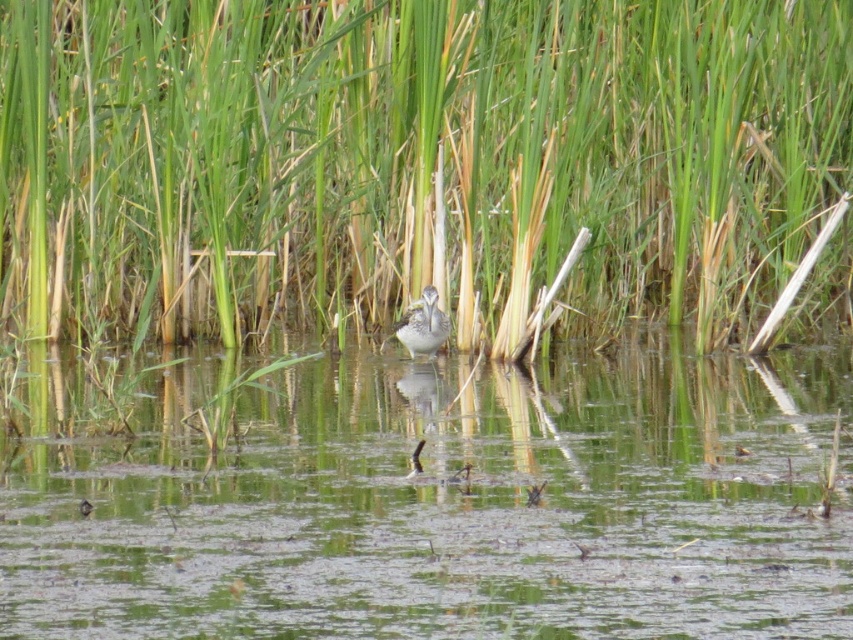
Is clear water at center bigger than speckled gray bird at center?

Incorrect, clear water at center is not larger than speckled gray bird at center.

Which is in front, point (524, 513) or point (413, 332)?

Point (524, 513)

I want to click on clear water at center, so click(440, 502).

The height and width of the screenshot is (640, 853). Identify the location of clear water at center. (440, 502).

Which of these two, green grass at center or clear water at center, stands taller?

Standing taller between the two is green grass at center.

Who is lower down, green grass at center or clear water at center?

Positioned lower is clear water at center.

This screenshot has height=640, width=853. In order to click on green grass at center in this screenshot , I will do `click(422, 163)`.

Between green grass at center and speckled gray bird at center, which one is positioned lower?

speckled gray bird at center is below.

Measure the distance between point (752, 84) and camera.

Point (752, 84) is 12.57 meters from camera.

I want to click on green grass at center, so click(422, 163).